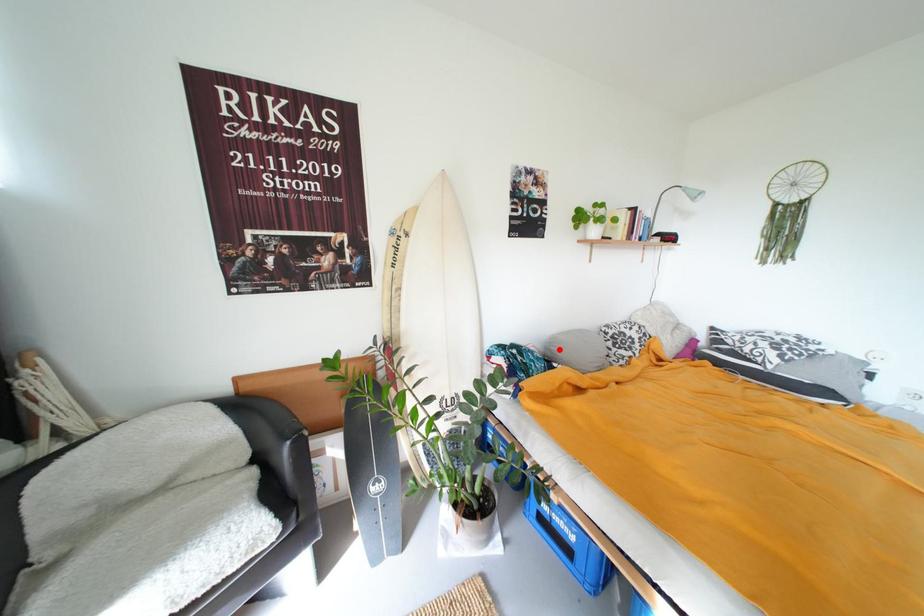
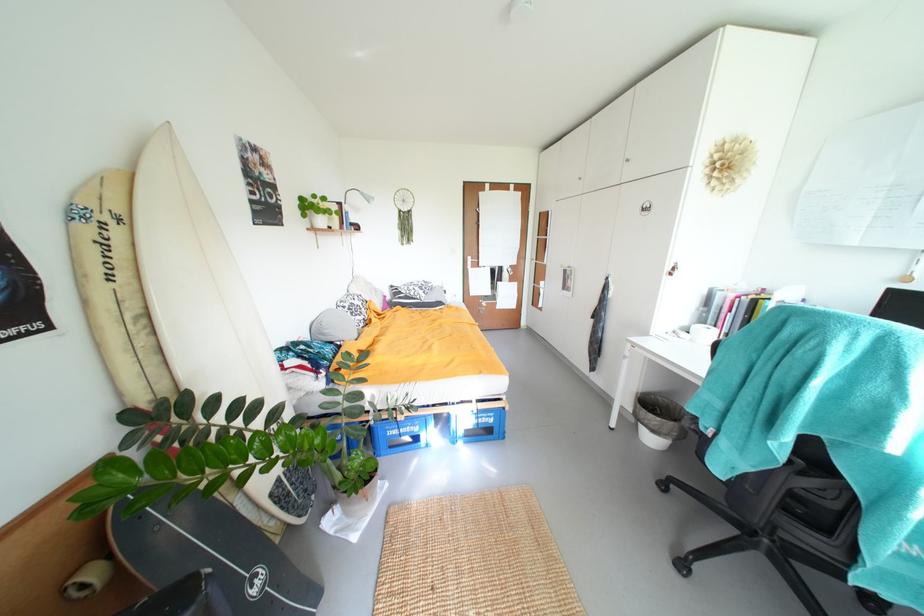
The point at the highlighted location is marked in the first image. Where is the corresponding point in the second image?

(333, 333)